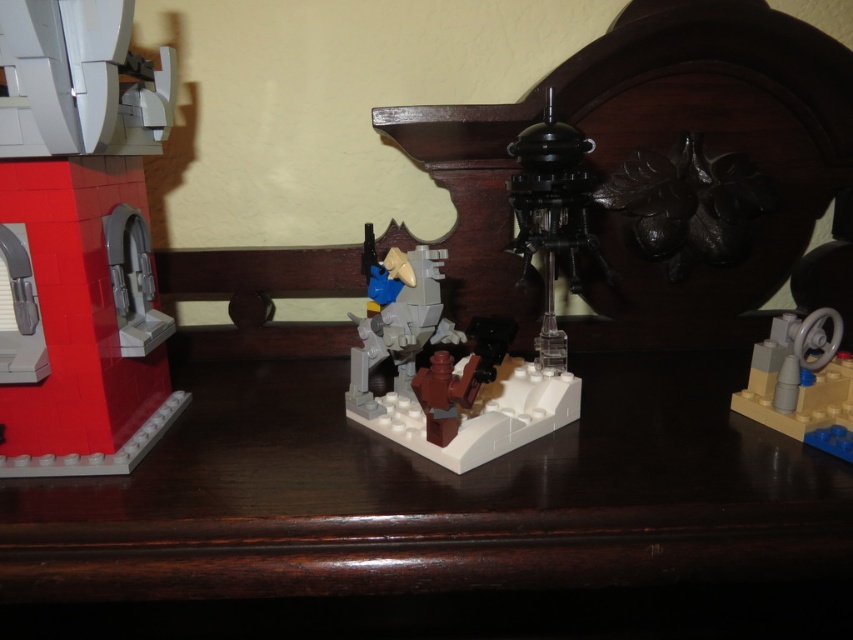
Based on the photo, is dark wood table at center taller than matte gray plastic figure at center?

No.

How much distance is there between dark wood table at center and matte gray plastic figure at center?

A distance of 4.14 inches exists between dark wood table at center and matte gray plastic figure at center.

Find the location of a particular element. This screenshot has width=853, height=640. dark wood table at center is located at coordinates (440, 520).

Between black plastic/transparent plastic at center and matte gray steering wheel at lower right, which one is positioned lower?

matte gray steering wheel at lower right

I want to click on black plastic/transparent plastic at center, so click(x=550, y=216).

Does smooth white tower at left have a smaller size compared to matte gray plastic figure at center?

Incorrect, smooth white tower at left is not smaller in size than matte gray plastic figure at center.

Is point (126, 268) in front of point (412, 422)?

That is False.

Find the location of a particular element. Image resolution: width=853 pixels, height=640 pixels. smooth white tower at left is located at coordinates (78, 241).